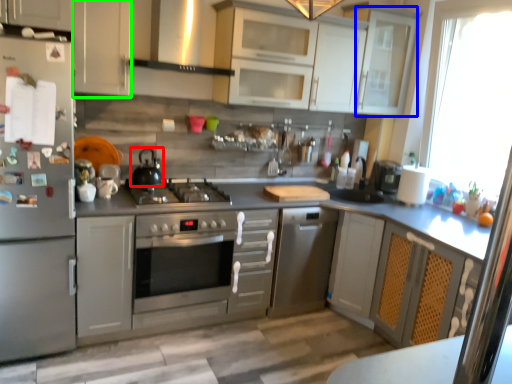
Question: Which object is the closest to the kitchen appliance (highlighted by a red box)? Choose among these: glass door (highlighted by a blue box) or cabinetry (highlighted by a green box).

Choices:
 (A) glass door
 (B) cabinetry

Answer: (B)